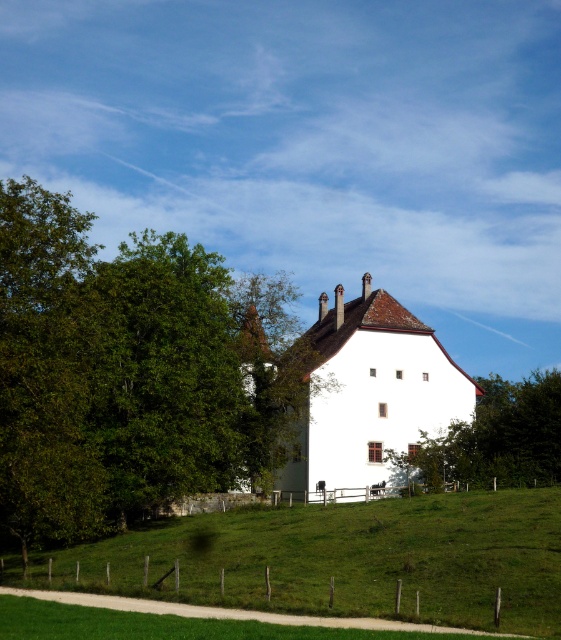
Is point (456, 506) positioned behind point (444, 456)?

No, (456, 506) is in front of (444, 456).

Find the location of a particular element. This screenshot has width=561, height=640. green grassy hillside at lower center is located at coordinates point(342,557).

Identify the location of green grassy hillside at lower center. coord(342,557).

Find the location of a particular element. This screenshot has width=561, height=640. green grassy hillside at lower center is located at coordinates click(342, 557).

Does green grassy hillside at lower center have a greater width compared to green grassy at lower center?

Yes.

This screenshot has height=640, width=561. Describe the element at coordinates (342, 557) in the screenshot. I see `green grassy hillside at lower center` at that location.

The height and width of the screenshot is (640, 561). What do you see at coordinates (342, 557) in the screenshot?
I see `green grassy hillside at lower center` at bounding box center [342, 557].

Where is `green grassy hillside at lower center`? This screenshot has width=561, height=640. green grassy hillside at lower center is located at coordinates (342, 557).

Measure the distance between point (19, 632) and camera.

They are 45.08 meters apart.

Can you confirm if green grassy at lower center is thinner than green leafy tree at center?

Correct, green grassy at lower center's width is less than green leafy tree at center's.

The width and height of the screenshot is (561, 640). In order to click on green grassy at lower center in this screenshot , I will do `click(199, 625)`.